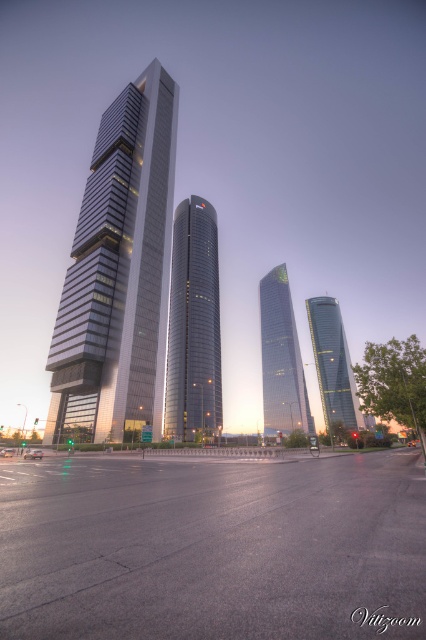
Question: Which object is closer to the camera taking this photo?

Choices:
 (A) metallic glass skyscraper at left
 (B) shiny glass skyscraper at center
 (C) green glass skyscraper at center
 (D) glassy reflective skyscraper at right

Answer: (A)

Question: Which object is farther from the camera taking this photo?

Choices:
 (A) metallic glass skyscraper at left
 (B) green glass skyscraper at center
 (C) shiny glass skyscraper at center
 (D) glassy reflective skyscraper at right

Answer: (B)

Question: Among these objects, which one is nearest to the camera?

Choices:
 (A) metallic glass skyscraper at left
 (B) green glass skyscraper at center
 (C) glassy reflective skyscraper at right

Answer: (A)

Question: Does shiny glass skyscraper at center appear on the left side of green glass skyscraper at center?

Choices:
 (A) no
 (B) yes

Answer: (B)

Question: Can you confirm if shiny glass skyscraper at center is positioned to the left of green glass skyscraper at center?

Choices:
 (A) no
 (B) yes

Answer: (B)

Question: Does metallic glass skyscraper at left have a lesser width compared to green glass skyscraper at center?

Choices:
 (A) yes
 (B) no

Answer: (B)